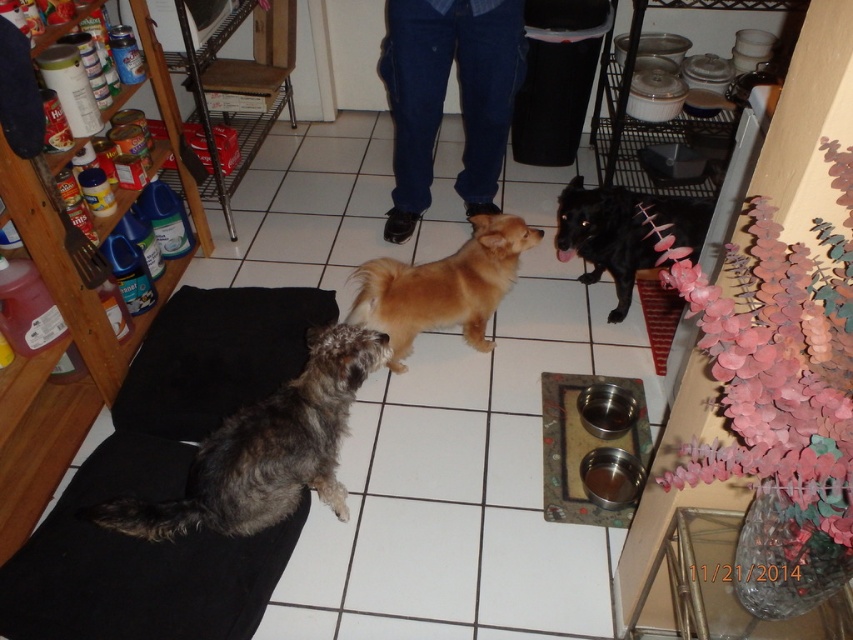
Question: Is blue jeans at center below black glossy dog at center?

Choices:
 (A) no
 (B) yes

Answer: (A)

Question: Which of the following is the farthest from the observer?

Choices:
 (A) black glossy dog at center
 (B) blue jeans at center

Answer: (B)

Question: Which point appears closest to the camera in this image?

Choices:
 (A) (412, 138)
 (B) (381, 332)
 (C) (503, 292)
 (D) (601, 253)

Answer: (B)

Question: Is gray shaggy dog at lower left thinner than black glossy dog at center?

Choices:
 (A) no
 (B) yes

Answer: (A)

Question: Which object appears closest to the camera in this image?

Choices:
 (A) golden fur dog at center
 (B) black glossy dog at center
 (C) gray shaggy dog at lower left
 (D) blue jeans at center

Answer: (C)

Question: Can you confirm if blue jeans at center is wider than golden fur dog at center?

Choices:
 (A) no
 (B) yes

Answer: (A)